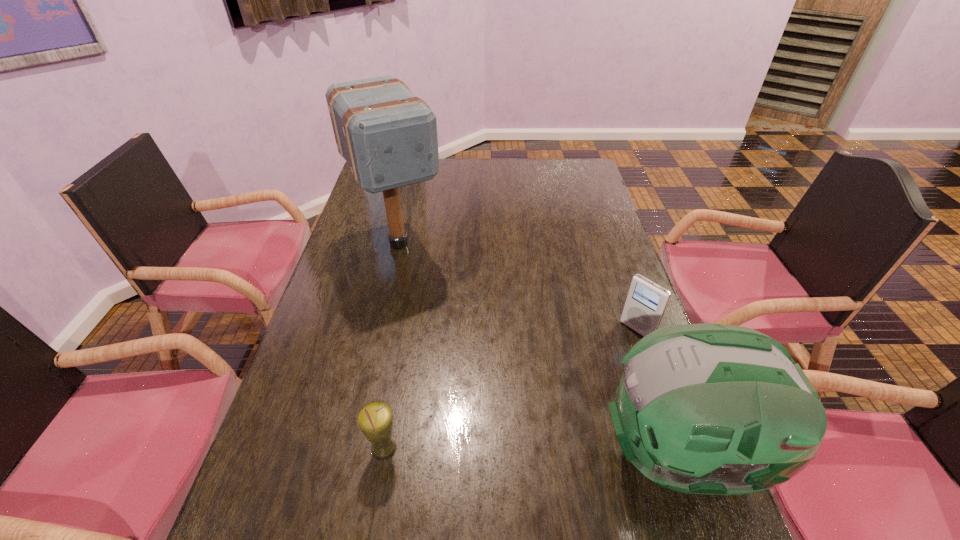
Where is `free space between the straw for drinking and the football helmet`? The height and width of the screenshot is (540, 960). free space between the straw for drinking and the football helmet is located at coordinates click(x=533, y=452).

The width and height of the screenshot is (960, 540). Find the location of `free space between the mallet and the second tallest object`. free space between the mallet and the second tallest object is located at coordinates (540, 349).

I want to click on object that is the closest to the second shortest object, so click(x=715, y=409).

This screenshot has width=960, height=540. I want to click on object that is the second closest to the second tallest object, so click(x=375, y=419).

At what (x,y) coordinates should I click in order to perform the action: click on vacant space that satisfies the following two spatial constraints: 1. on the front side of the third shortest object; 2. on the visor of the second farthest object. Please return your answer as a coordinate pair (x, y). Looking at the image, I should click on (681, 455).

The image size is (960, 540). I want to click on free space that satisfies the following two spatial constraints: 1. on the front side of the third nearest object; 2. on the visor of the third shortest object, so pyautogui.click(x=681, y=455).

Locate an element on the screen. This screenshot has width=960, height=540. vacant space that satisfies the following two spatial constraints: 1. on the front side of the iPod; 2. on the visor of the second tallest object is located at coordinates (681, 455).